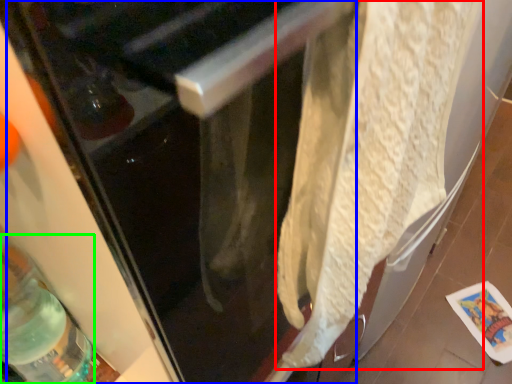
Question: Which object is the farthest from wrap (highlighted by a red box)? Choose among these: screen door (highlighted by a blue box) or bottle (highlighted by a green box).

Choices:
 (A) screen door
 (B) bottle

Answer: (B)